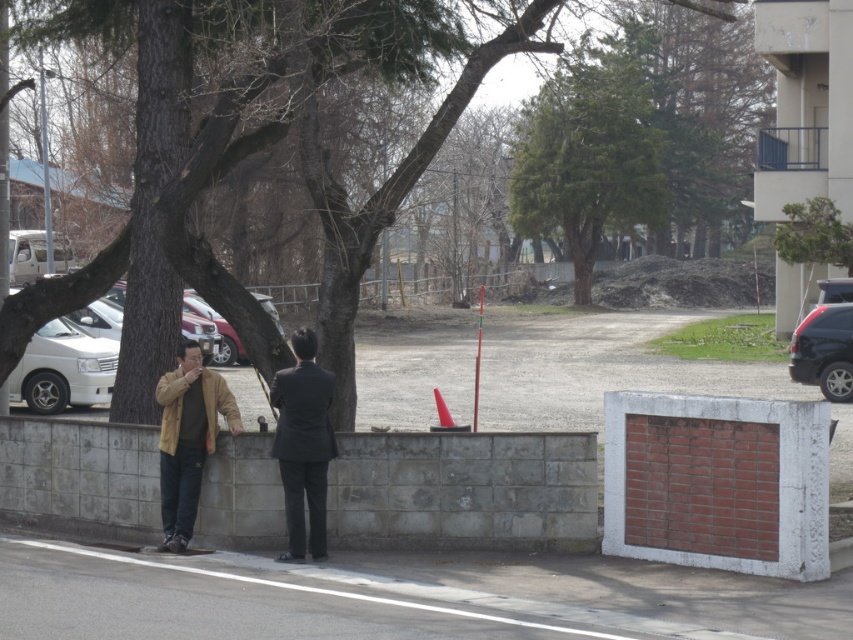
Can you confirm if white matte van at left is positioned above shiny black suv at right?

No.

Between white matte van at left and shiny black suv at right, which one appears on the left side from the viewer's perspective?

From the viewer's perspective, white matte van at left appears more on the left side.

Identify the location of white matte van at left. (62, 369).

Does gray concrete wall at center have a smaller size compared to shiny black suv at right?

No.

Does gray concrete wall at center have a larger size compared to shiny black suv at right?

Yes.

What do you see at coordinates (463, 492) in the screenshot? The image size is (853, 640). I see `gray concrete wall at center` at bounding box center [463, 492].

You are a GUI agent. You are given a task and a screenshot of the screen. Output one action in this format:
    pyautogui.click(x=<x>, y=<y>)
    Task: Click on the gray concrete wall at center
    The width and height of the screenshot is (853, 640).
    Given the screenshot: What is the action you would take?
    (x=463, y=492)

Between brown bark tree at center and matte brown jacket at left, which one appears on the left side from the viewer's perspective?

From the viewer's perspective, matte brown jacket at left appears more on the left side.

The height and width of the screenshot is (640, 853). What are the coordinates of `brown bark tree at center` in the screenshot? It's located at (190, 188).

The image size is (853, 640). In order to click on brown bark tree at center in this screenshot , I will do `click(190, 188)`.